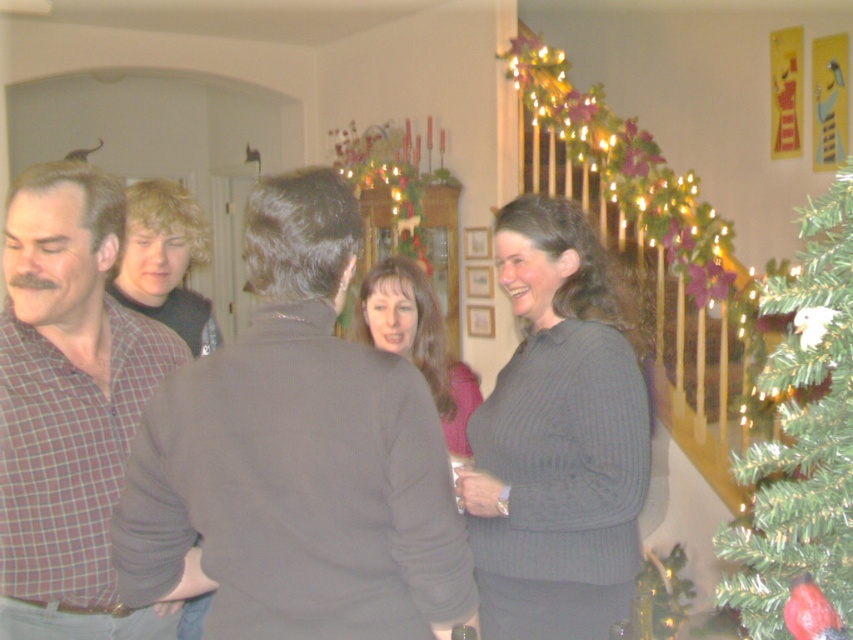
Between dark gray sweater at center and gray ribbed sweater at center, which one has less height?

dark gray sweater at center is shorter.

Is the position of dark gray sweater at center less distant than that of gray ribbed sweater at center?

That is True.

Find the location of a particular element. The height and width of the screenshot is (640, 853). dark gray sweater at center is located at coordinates (296, 458).

In the scene shown: Which is more to the left, gray ribbed sweater at center or plaid shirt at left?

plaid shirt at left

Is point (503, 416) positioned after point (86, 525)?

Yes, it is.

Locate an element on the screen. This screenshot has width=853, height=640. gray ribbed sweater at center is located at coordinates (556, 436).

This screenshot has height=640, width=853. Describe the element at coordinates (556, 436) in the screenshot. I see `gray ribbed sweater at center` at that location.

Where is `gray ribbed sweater at center`? The height and width of the screenshot is (640, 853). gray ribbed sweater at center is located at coordinates (556, 436).